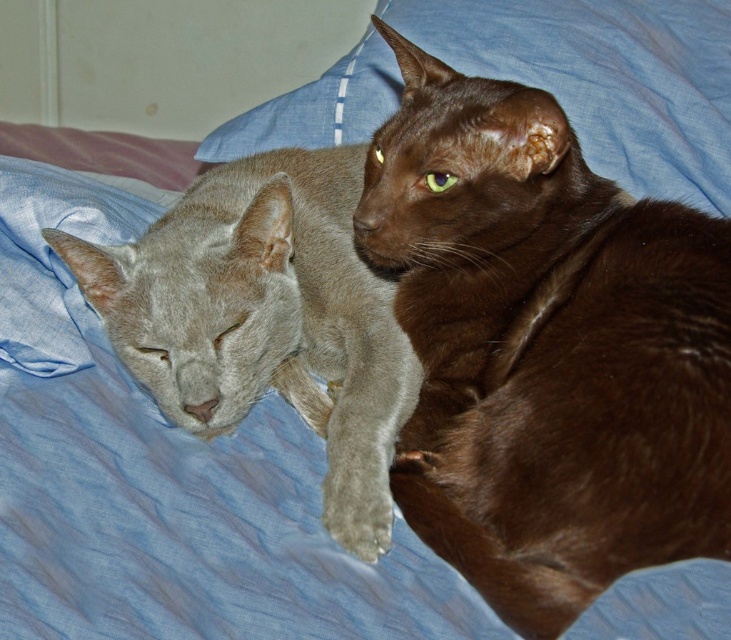
Who is more distant from viewer, (208, 304) or (564, 8)?

The point (564, 8) is behind.

Is satin gray cat at left bigger than blue fabric pillow at upper center?

No.

Find the location of a particular element. Image resolution: width=731 pixels, height=640 pixels. satin gray cat at left is located at coordinates (265, 316).

Which is below, brown silky cat at upper right or blue fabric pillow at upper center?

brown silky cat at upper right

Who is more distant from viewer, (651,436) or (594,38)?

Positioned behind is point (594,38).

Where is `brown silky cat at upper right`? The image size is (731, 640). brown silky cat at upper right is located at coordinates (545, 348).

Where is `brown silky cat at upper right`? The width and height of the screenshot is (731, 640). brown silky cat at upper right is located at coordinates (545, 348).

Can you confirm if brown silky cat at upper right is bigger than satin gray cat at left?

Yes.

Is brown silky cat at upper right above satin gray cat at left?

Yes, brown silky cat at upper right is above satin gray cat at left.

Describe the element at coordinates (545, 348) in the screenshot. This screenshot has height=640, width=731. I see `brown silky cat at upper right` at that location.

Find the location of a particular element. brown silky cat at upper right is located at coordinates (545, 348).